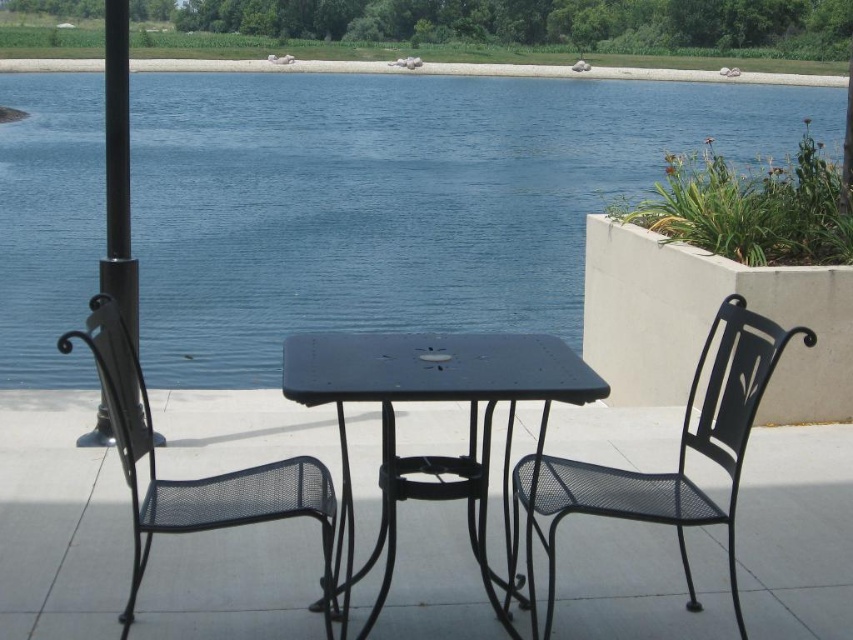
You are a painter standing on the patio and want to set up your easel. You notice the black mesh chair at left and the black metal pole at left. Which object should you avoid placing your easel in front of to ensure it won

The black mesh chair at left is shorter than the black metal pole at left. To ensure your easel is visible from behind, avoid placing it in front of the black metal pole at left since it is taller and could block the view.

You are sitting on the black mesh chair at left and want to look at the blue water at center. Which direction should you turn your head to see it?

Since the blue water at center is further to the viewer than the black mesh chair at left, you would need to turn your head forward to look towards the blue water at center, as it is positioned closer to you compared to the chair you are sitting on.

You are planning to place a large potted plant between the blue water at center and the black mesh chair at left. Based on their sizes, will the plant fit without overlapping either?

The blue water at center is wider than the black mesh chair at left, so there is sufficient space between them to place the large potted plant without overlapping either.